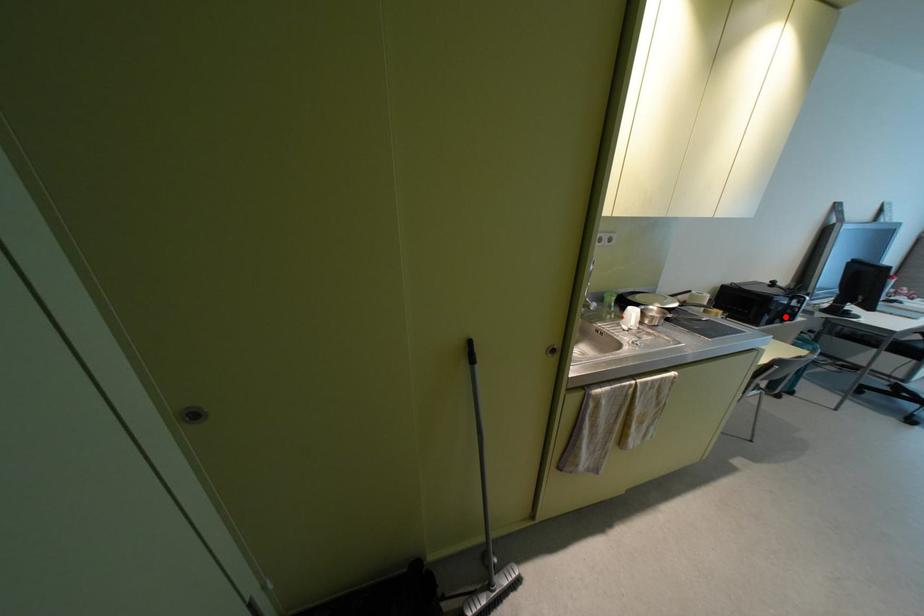
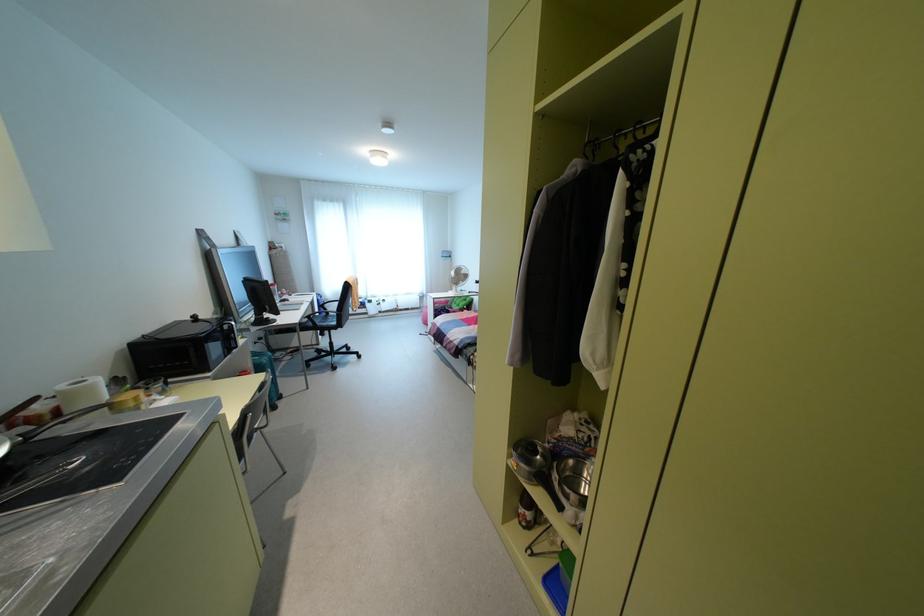
Question: I am providing you with two images of the same scene from different viewpoints. Image1 has a red point marked. In image2, the corresponding 3D location appears at what relative position? Reply with the corresponding letter.

Choices:
 (A) Closer
 (B) Farther

Answer: (A)